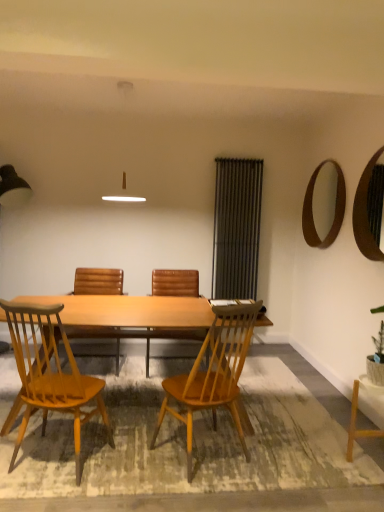
Question: Choose the correct answer: Is light brown wood chair at center, the first chair when ordered from front to back, inside green leafy plant at lower right or outside it?

Choices:
 (A) outside
 (B) inside

Answer: (A)

Question: From a real-world perspective, is light brown wood chair at center, marked as the 4th chair in a back-to-front arrangement, positioned above or below green leafy plant at lower right?

Choices:
 (A) below
 (B) above

Answer: (A)

Question: Which object is the closest to the wooden mirror at upper right?

Choices:
 (A) metallic silver screen door at right
 (B) light brown wood chair at center, the first chair when ordered from front to back
 (C) wooden textured chair at center, the first chair in the back-to-front sequence
 (D) brown leather chair at center, the 3th chair from the front
 (E) light wood desk at center

Answer: (A)

Question: Which object is positioned farthest from the wooden textured chair at center, the first chair in the back-to-front sequence?

Choices:
 (A) green leafy plant at lower right
 (B) light brown wood chair at center, marked as the 4th chair in a back-to-front arrangement
 (C) wooden mirror at upper right
 (D) brown leather chair at center, which is the second chair from back to front
 (E) light wood desk at center

Answer: (A)